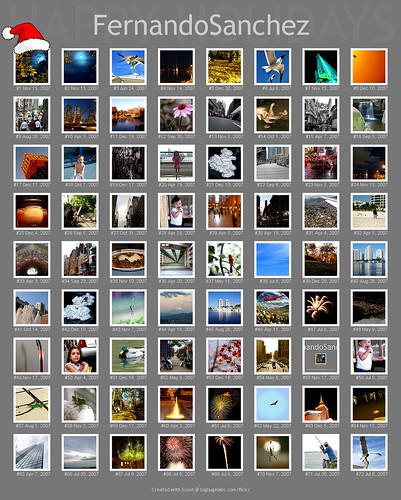
Find the location of `picture corners`. picture corners is located at coordinates (32, 67), (369, 61), (28, 452), (374, 447).